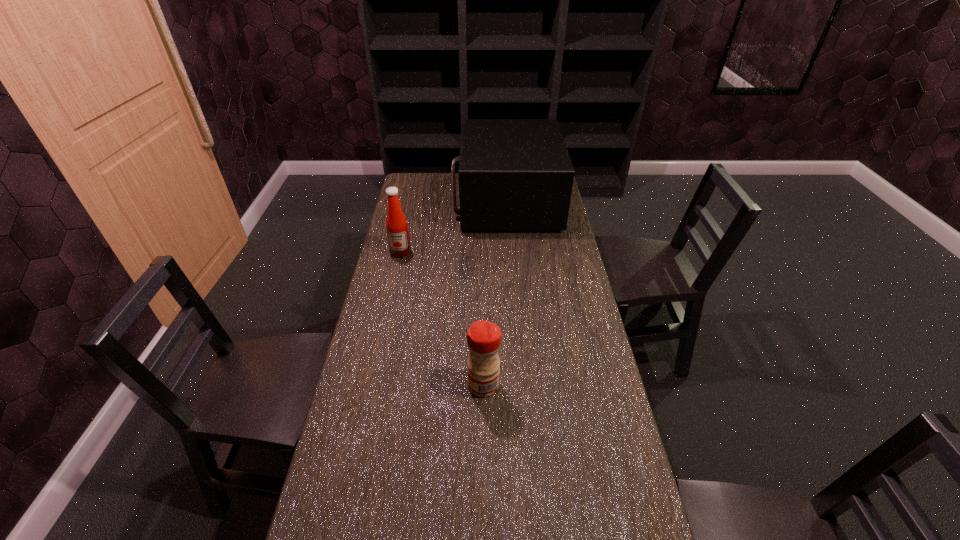
Locate an element on the screen. Image resolution: width=960 pixels, height=540 pixels. object located in the far edge section of the desktop is located at coordinates (514, 174).

At what (x,y) coordinates should I click in order to perform the action: click on object at the left edge. Please return your answer as a coordinate pair (x, y). Image resolution: width=960 pixels, height=540 pixels. Looking at the image, I should click on (396, 224).

I want to click on object that is at the right edge, so click(x=514, y=174).

I want to click on object that is positioned at the far right corner, so click(x=514, y=174).

In order to click on vacant position at the left edge of the desktop in this screenshot , I will do `click(371, 365)`.

I want to click on blank area at the right edge, so click(570, 279).

The width and height of the screenshot is (960, 540). What are the coordinates of `free space at the far left corner of the desktop` in the screenshot? It's located at (401, 194).

Locate an element on the screen. The image size is (960, 540). free area in between the shortest object and the second nearest object is located at coordinates (443, 319).

Where is `free space between the farthest object and the nearest object`? The height and width of the screenshot is (540, 960). free space between the farthest object and the nearest object is located at coordinates (495, 293).

Where is `free area in between the farthest object and the second nearest object`? This screenshot has width=960, height=540. free area in between the farthest object and the second nearest object is located at coordinates (453, 227).